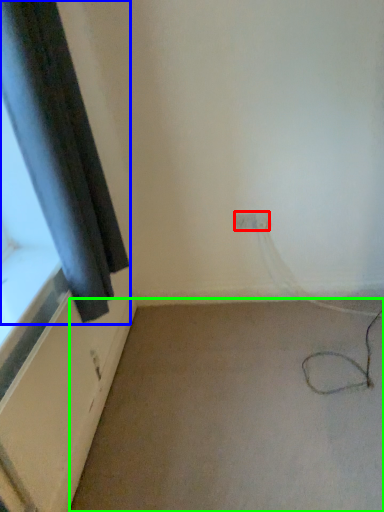
Question: Which is nearer to the electric outlet (highlighted by a red box)? curtain (highlighted by a blue box) or plain (highlighted by a green box).

Choices:
 (A) curtain
 (B) plain

Answer: (B)